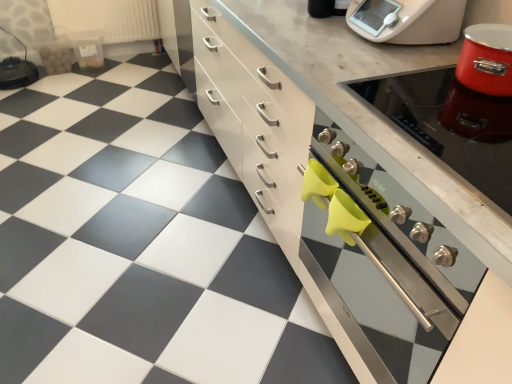
You are a GUI agent. You are given a task and a screenshot of the screen. Output one action in this format:
    pyautogui.click(x=<x>, y=<y>)
    Task: Click on the vacant space to the left of white plastic food processor at upper right
    This screenshot has height=384, width=512.
    Given the screenshot: What is the action you would take?
    (x=300, y=33)